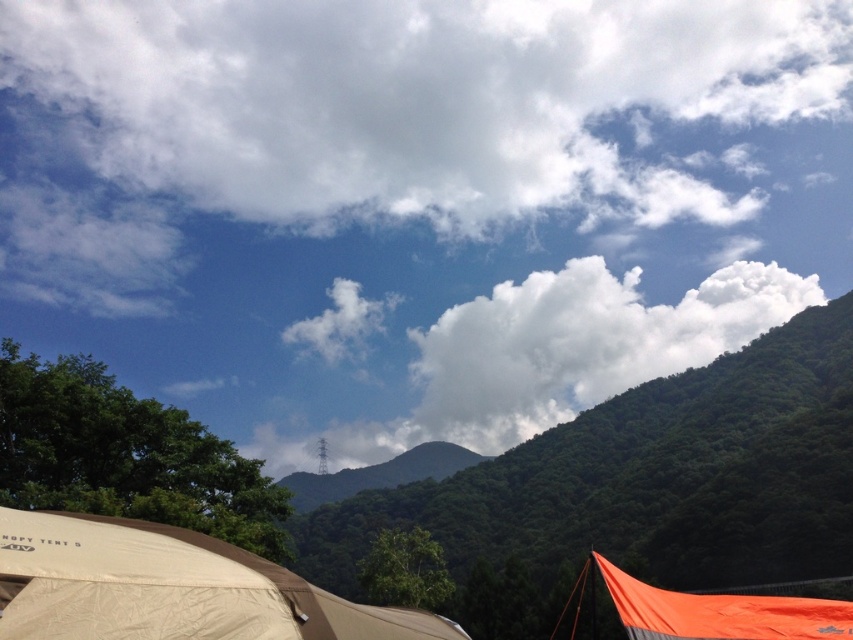
Between white fluffy cloud at upper center and orange fabric tent at lower right, which one appears on the right side from the viewer's perspective?

orange fabric tent at lower right

Is white fluffy cloud at upper center positioned in front of orange fabric tent at lower right?

No, it is behind orange fabric tent at lower right.

Is point (36, 45) behind point (755, 627)?

Yes, point (36, 45) is behind point (755, 627).

The image size is (853, 640). What are the coordinates of `white fluffy cloud at upper center` in the screenshot? It's located at [x=418, y=97].

Who is more forward, [326,604] or [602,580]?

Point [326,604] is more forward.

The width and height of the screenshot is (853, 640). What are the coordinates of `beige fabric tent at lower left` in the screenshot? It's located at (169, 588).

Who is more distant from viewer, (379, 497) or (515, 321)?

Positioned behind is point (515, 321).

Which of these two, green leafy hillside at upper center or white fluffy cloud at center, stands taller?

Standing taller between the two is white fluffy cloud at center.

This screenshot has height=640, width=853. I want to click on green leafy hillside at upper center, so click(x=648, y=477).

Locate an element on the screen. green leafy hillside at upper center is located at coordinates (x=648, y=477).